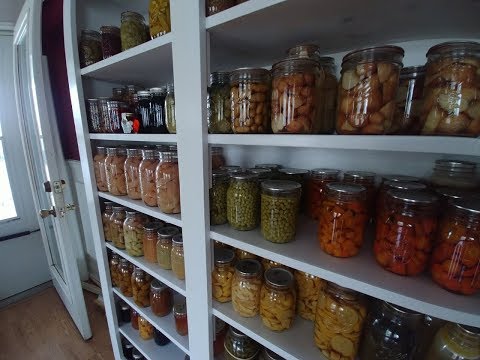
Identify the location of door. [x=50, y=231].